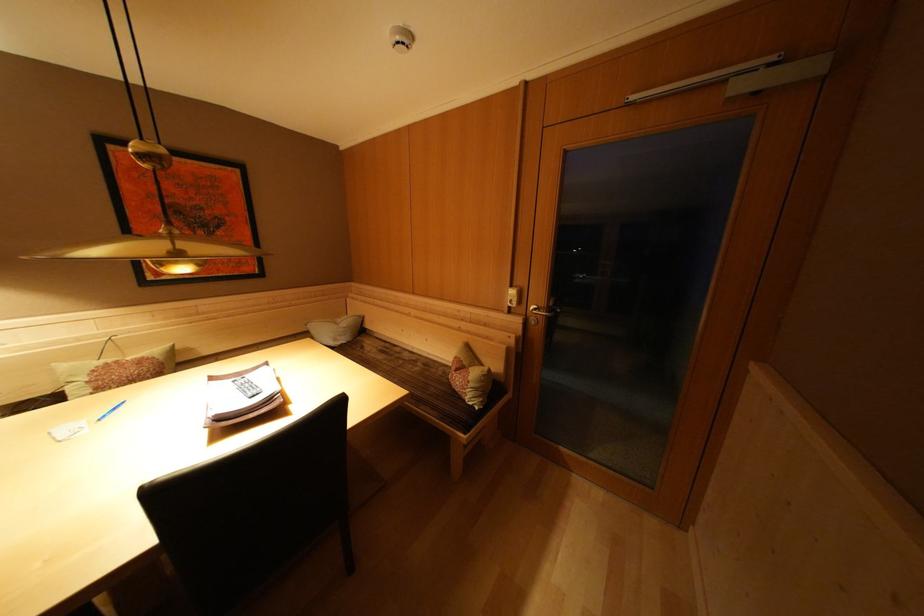
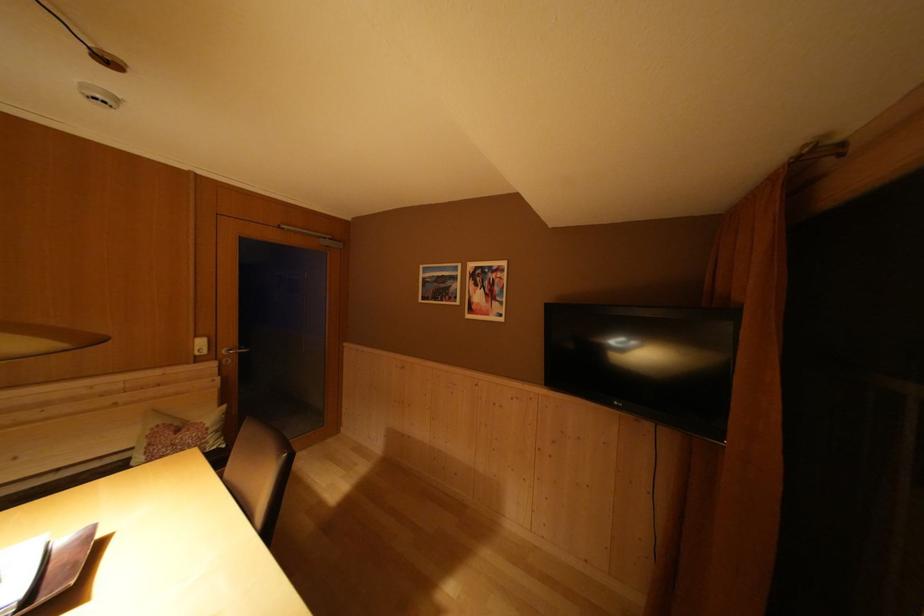
Find the pixel in the second image that matches [518,291] in the first image.

(203, 342)